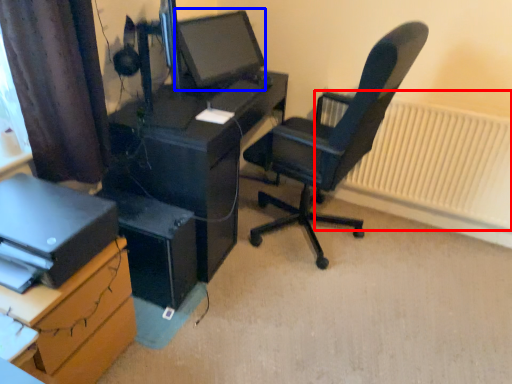
Question: Which object is further to the camera taking this photo, radiator (highlighted by a red box) or computer monitor (highlighted by a blue box)?

Choices:
 (A) radiator
 (B) computer monitor

Answer: (A)